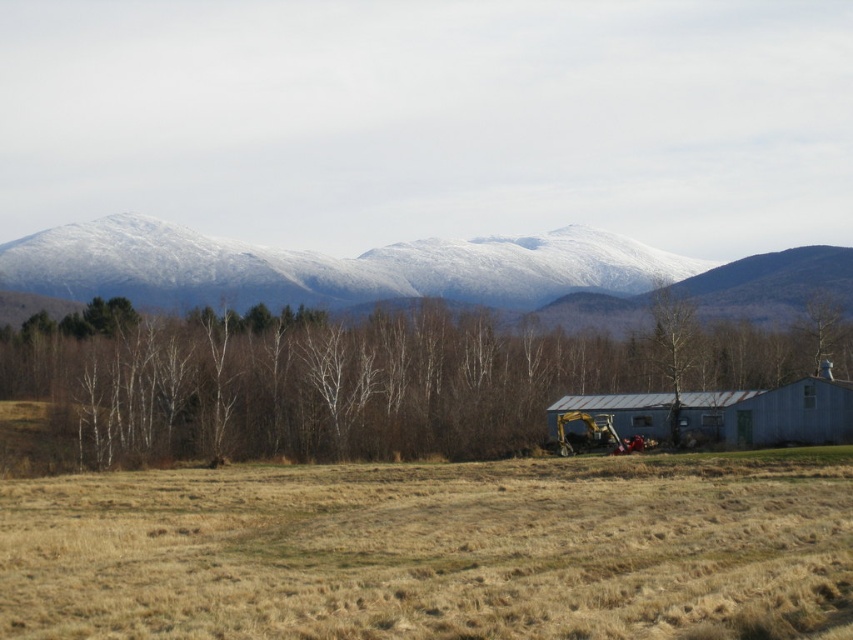
Can you confirm if brown leafless trees at center is positioned above snow-covered mountain at upper center?

Incorrect, brown leafless trees at center is not positioned above snow-covered mountain at upper center.

Which is more to the left, brown leafless trees at center or snow-covered mountain at upper center?

brown leafless trees at center

What do you see at coordinates (358, 380) in the screenshot? This screenshot has height=640, width=853. I see `brown leafless trees at center` at bounding box center [358, 380].

You are a GUI agent. You are given a task and a screenshot of the screen. Output one action in this format:
    pyautogui.click(x=<x>, y=<y>)
    Task: Click on the brown leafless trees at center
    
    Given the screenshot: What is the action you would take?
    click(x=358, y=380)

Does brown grassy field at lower center appear on the left side of smooth white tree at center?

Indeed, brown grassy field at lower center is positioned on the left side of smooth white tree at center.

Describe the element at coordinates (437, 548) in the screenshot. The image size is (853, 640). I see `brown grassy field at lower center` at that location.

Where is `brown grassy field at lower center`? brown grassy field at lower center is located at coordinates (437, 548).

Between brown grassy field at lower center and brown leafless trees at center, which one has more height?

Standing taller between the two is brown leafless trees at center.

Does brown grassy field at lower center have a greater width compared to brown leafless trees at center?

No.

At what (x,y) coordinates should I click in order to perform the action: click on brown grassy field at lower center. Please return your answer as a coordinate pair (x, y). This screenshot has height=640, width=853. Looking at the image, I should click on (437, 548).

Identify the location of brown grassy field at lower center. (437, 548).